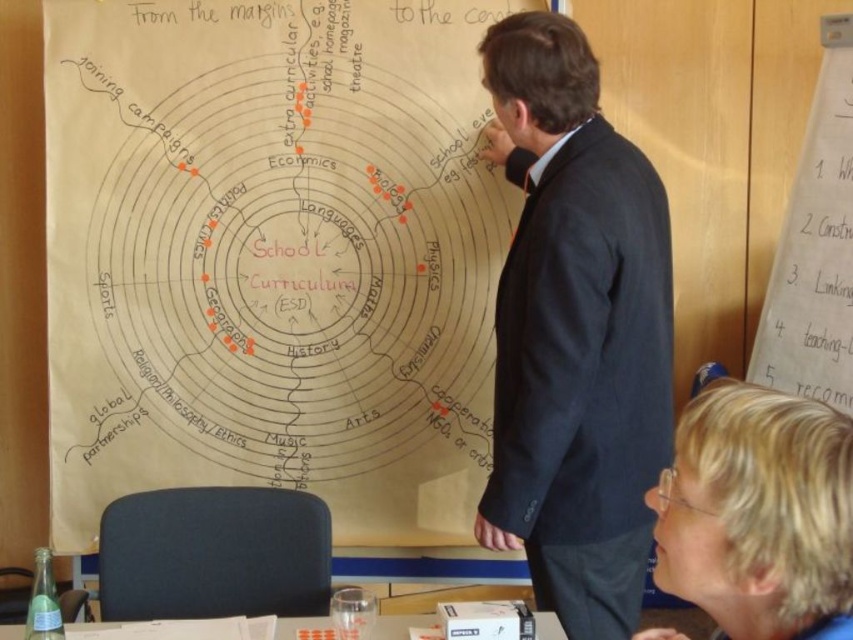
The width and height of the screenshot is (853, 640). What do you see at coordinates (575, 332) in the screenshot?
I see `dark blue suit at center` at bounding box center [575, 332].

Who is shorter, dark blue suit at center or blonde hair at lower right?

blonde hair at lower right is shorter.

Is point (537, 148) in front of point (766, 506)?

No, it is behind (766, 506).

Where is `dark blue suit at center`? The width and height of the screenshot is (853, 640). dark blue suit at center is located at coordinates (575, 332).

How much distance is there between white paper at upper right and white paper at lower center?

The distance of white paper at upper right from white paper at lower center is 4.71 feet.

Who is positioned more to the left, white paper at upper right or white paper at lower center?

white paper at lower center

Does point (780, 324) lie behind point (107, 621)?

Yes, point (780, 324) is farther from viewer.

At what (x,y) coordinates should I click in order to perform the action: click on white paper at upper right. Please return your answer as a coordinate pair (x, y). The width and height of the screenshot is (853, 640). Looking at the image, I should click on (814, 252).

Locate an element on the screen. The image size is (853, 640). blonde hair at lower right is located at coordinates (757, 512).

What do you see at coordinates (757, 512) in the screenshot? I see `blonde hair at lower right` at bounding box center [757, 512].

Find the location of a particular element. This screenshot has width=853, height=640. blonde hair at lower right is located at coordinates (757, 512).

What are the coordinates of `blonde hair at lower right` in the screenshot? It's located at (757, 512).